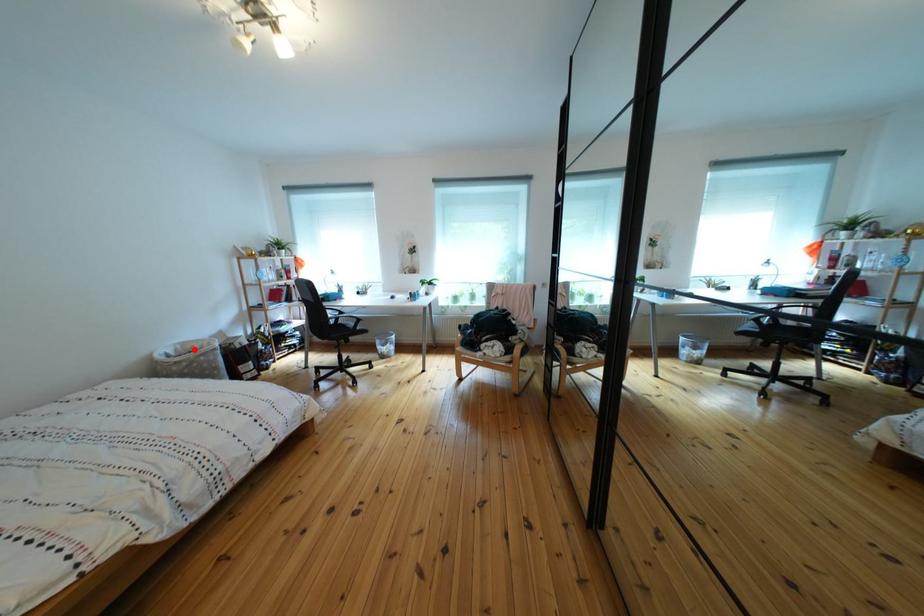
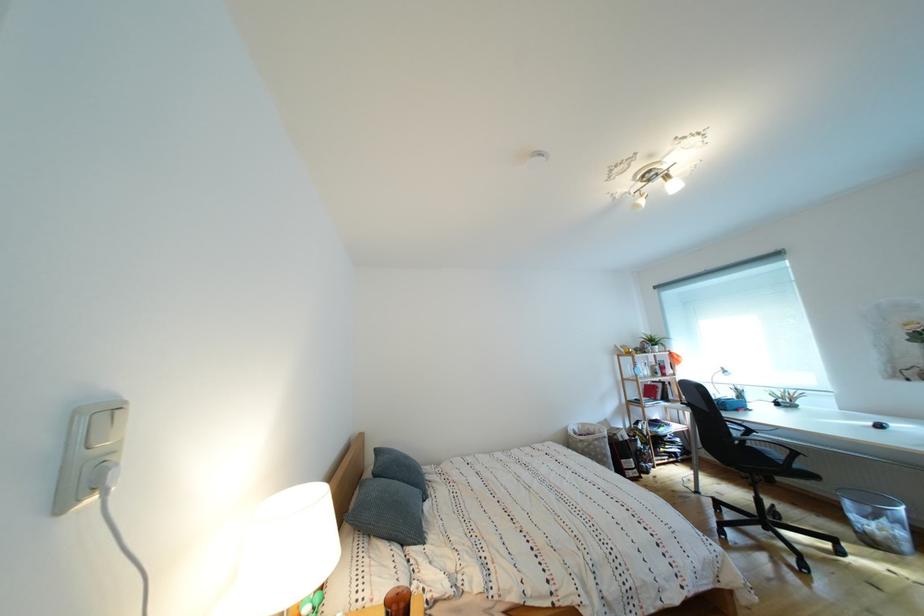
Question: I am providing you with two images of the same scene from different viewpoints. Given a red point in image1, look at the same physical point in image2. Is it:

Choices:
 (A) Closer to the viewpoint
 (B) Farther from the viewpoint

Answer: (B)